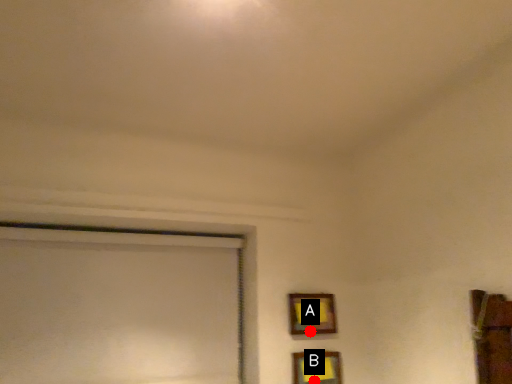
Question: Two points are circled on the image, labeled by A and B beside each circle. Which point appears closest to the camera in this image?

Choices:
 (A) A is closer
 (B) B is closer

Answer: (B)